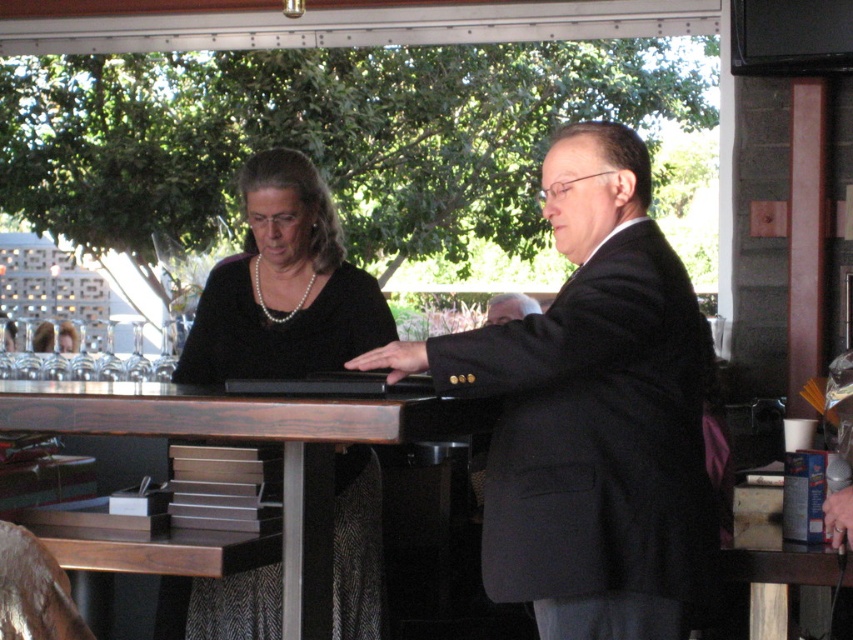
Who is higher up, dark wood table at center or matte black laptop at center?

matte black laptop at center

Is dark wood table at center above matte black laptop at center?

No.

Who is more distant from viewer, (299, 554) or (387, 369)?

The point (387, 369) is more distant.

Where is `dark wood table at center`? The image size is (853, 640). dark wood table at center is located at coordinates (241, 438).

Is black wool suit at right to the left of matte black laptop at center from the viewer's perspective?

No, black wool suit at right is not to the left of matte black laptop at center.

Is black wool suit at right in front of matte black laptop at center?

Yes, it is.

Where is `black wool suit at right`? black wool suit at right is located at coordinates (596, 435).

The height and width of the screenshot is (640, 853). What are the coordinates of `black wool suit at right` in the screenshot? It's located at (596, 435).

Does black matte suit at center lie behind black pearl necklace at center?

No, black matte suit at center is in front of black pearl necklace at center.

Who is more forward, (546, 381) or (206, 385)?

Positioned in front is point (546, 381).

Between point (552, 220) and point (206, 605), which one is positioned behind?

The point (206, 605) is more distant.

The image size is (853, 640). What are the coordinates of `black matte suit at center` in the screenshot? It's located at (596, 413).